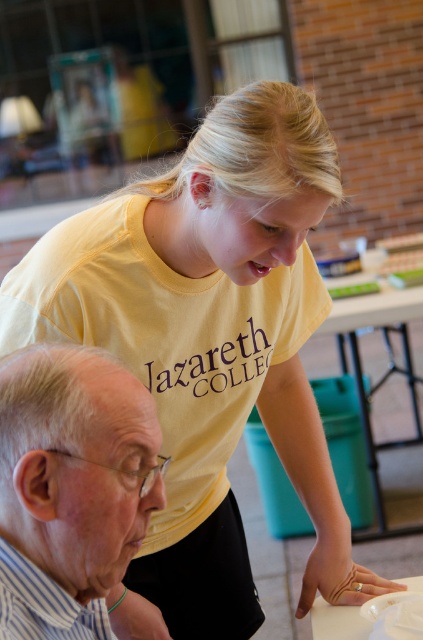
Question: Which is nearer to the white striped fabric at lower left?

Choices:
 (A) green plastic table at center
 (B) white glossy table at lower center

Answer: (B)

Question: Which of the following is the farthest from the observer?

Choices:
 (A) (82, 605)
 (B) (419, 296)
 (C) (324, 609)

Answer: (B)

Question: Does white striped fabric at lower left have a smaller size compared to white glossy table at lower center?

Choices:
 (A) yes
 (B) no

Answer: (A)

Question: Which of these objects is positioned closest to the white glossy table at lower center?

Choices:
 (A) green plastic table at center
 (B) striped fabric shirt at lower left
 (C) white striped fabric at lower left

Answer: (C)

Question: Does striped fabric shirt at lower left have a greater width compared to white glossy table at lower center?

Choices:
 (A) yes
 (B) no

Answer: (B)

Question: Can you confirm if striped fabric shirt at lower left is bigger than white striped fabric at lower left?

Choices:
 (A) no
 (B) yes

Answer: (B)